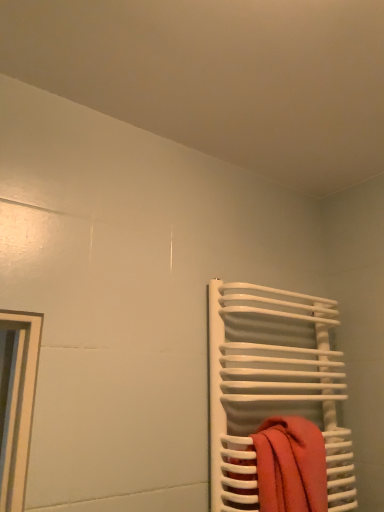
Question: From the image's perspective, is orange cotton towel at right above or below white glossy towel rack at right?

Choices:
 (A) below
 (B) above

Answer: (A)

Question: Considering the positions of orange cotton towel at right and white glossy towel rack at right in the image, is orange cotton towel at right wider or thinner than white glossy towel rack at right?

Choices:
 (A) thin
 (B) wide

Answer: (A)

Question: In the image, is orange cotton towel at right on the left side or the right side of white glossy towel rack at right?

Choices:
 (A) right
 (B) left

Answer: (B)

Question: Is white glossy towel rack at right taller or shorter than orange cotton towel at right?

Choices:
 (A) short
 (B) tall

Answer: (B)

Question: Is point (279, 318) closer or farther from the camera than point (327, 507)?

Choices:
 (A) closer
 (B) farther

Answer: (B)

Question: Relative to orange cotton towel at right, is white glossy towel rack at right in front or behind?

Choices:
 (A) front
 (B) behind

Answer: (B)

Question: Is white glossy towel rack at right bigger or smaller than orange cotton towel at right?

Choices:
 (A) big
 (B) small

Answer: (A)